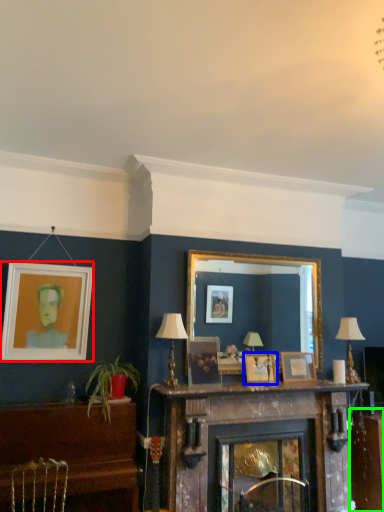
Question: Based on their relative distances, which object is nearer to picture frame (highlighted by a red box)? Choose from picture frame (highlighted by a blue box) and table (highlighted by a green box).

Choices:
 (A) picture frame
 (B) table

Answer: (A)